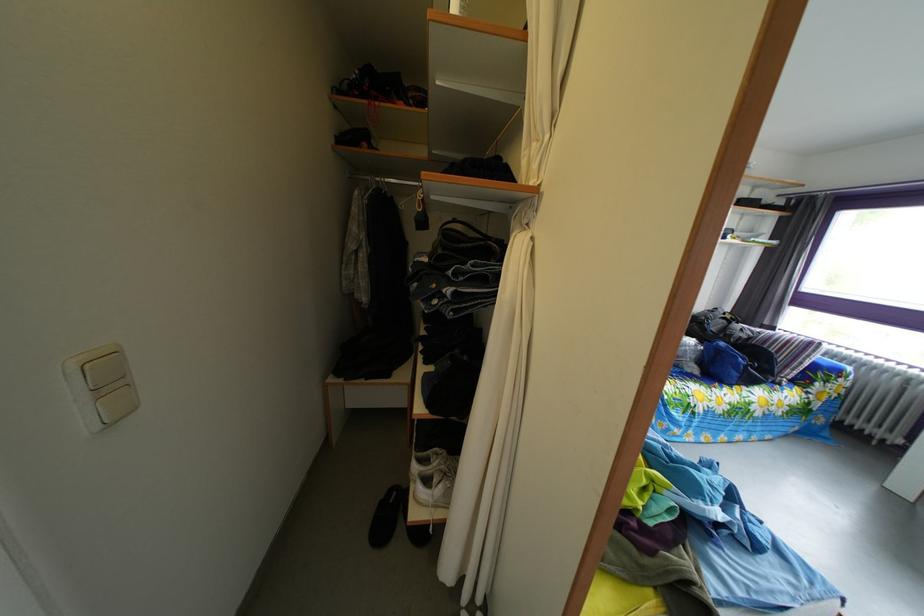
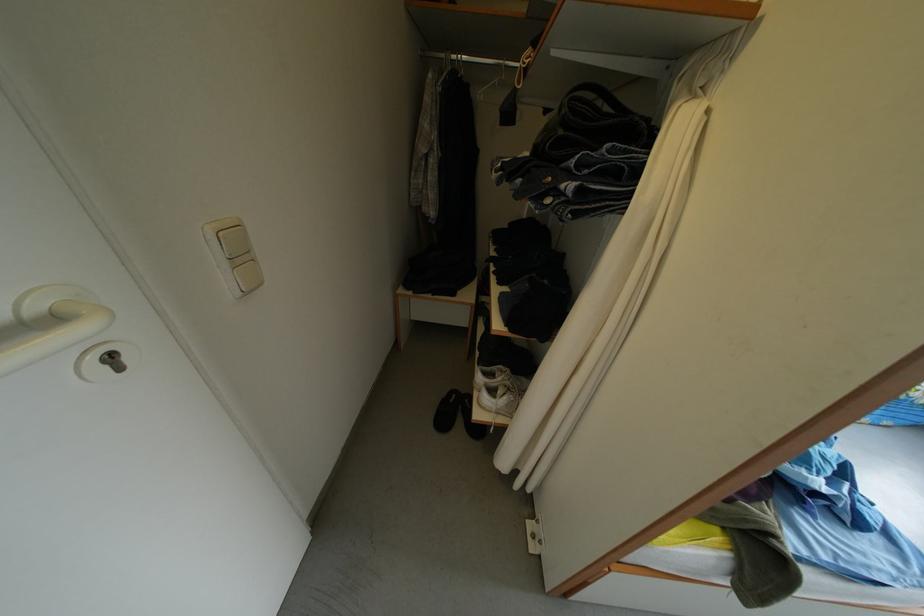
The point at [411,535] is marked in the first image. Where is the corresponding point in the second image?

(470, 430)